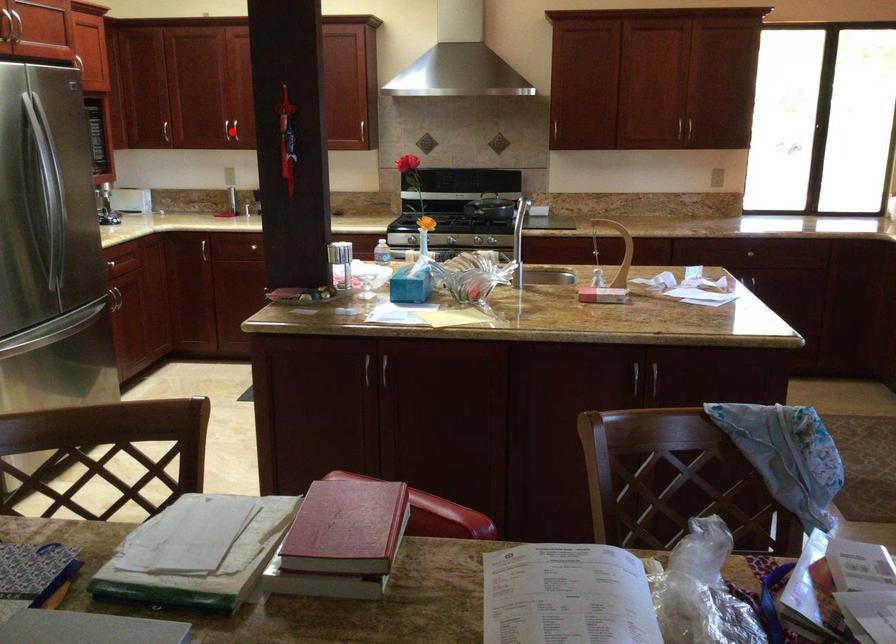
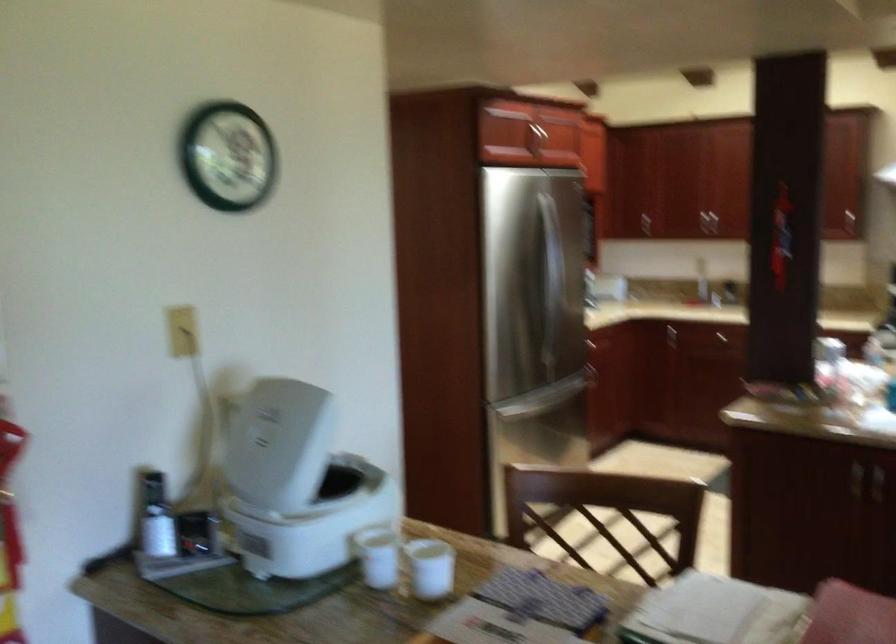
Question: I am providing you with two images of the same scene from different viewpoints. A red point is marked on the first image. Is the red point's position out of view in image 2?

Choices:
 (A) Yes
 (B) No

Answer: (A)